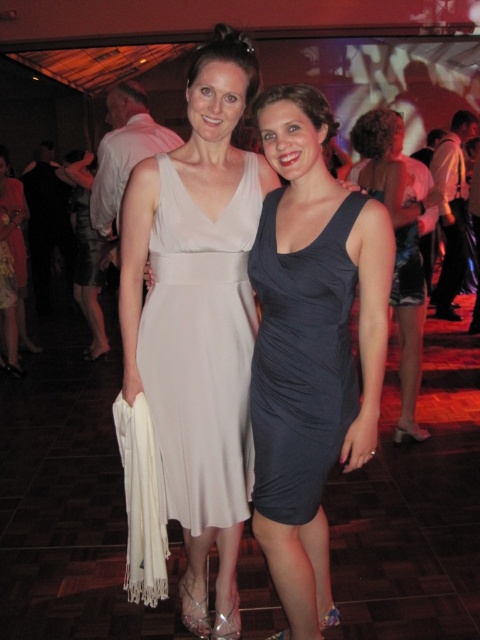
In the scene shown: Is satin white dress at center to the right of dark gray satin dress at center from the viewer's perspective?

No, satin white dress at center is not to the right of dark gray satin dress at center.

From the picture: Is satin white dress at center bigger than dark gray satin dress at center?

Yes.

Is point (169, 285) closer to camera compared to point (310, 436)?

No, (169, 285) is behind (310, 436).

Find the location of a particular element. The width and height of the screenshot is (480, 640). satin white dress at center is located at coordinates (201, 349).

Between matte white dress at center and satin white dress at center, which one appears on the right side from the viewer's perspective?

Positioned to the right is satin white dress at center.

Is point (212, 371) positioned in front of point (168, 358)?

No.

The image size is (480, 640). I want to click on matte white dress at center, so click(199, 317).

Is point (346, 272) farther from camera compared to point (384, 163)?

That is False.

Measure the distance from dark gray satin dress at center to dark blue satin dress at center.

dark gray satin dress at center is 4.80 feet from dark blue satin dress at center.

Who is more forward, (304,483) or (419,300)?

Positioned in front is point (304,483).

Locate an element on the screen. This screenshot has height=640, width=480. dark gray satin dress at center is located at coordinates (300, 362).